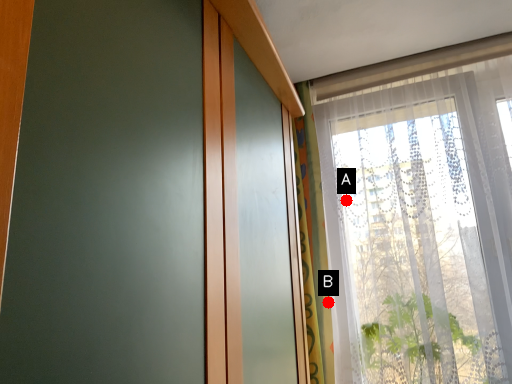
Question: Two points are circled on the image, labeled by A and B beside each circle. Which point appears closest to the camera in this image?

Choices:
 (A) A is closer
 (B) B is closer

Answer: (B)